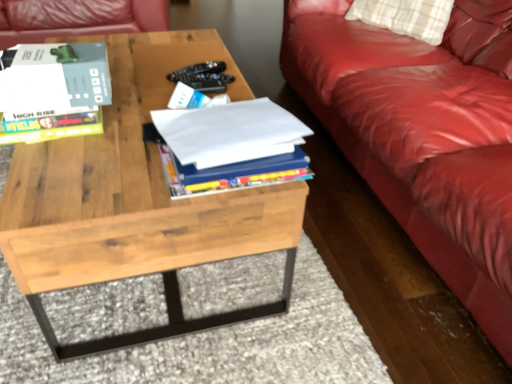
This screenshot has height=384, width=512. What are the coordinates of `blank space above natural wood coffee table at center (from a real-world perspective)` in the screenshot? It's located at (121, 106).